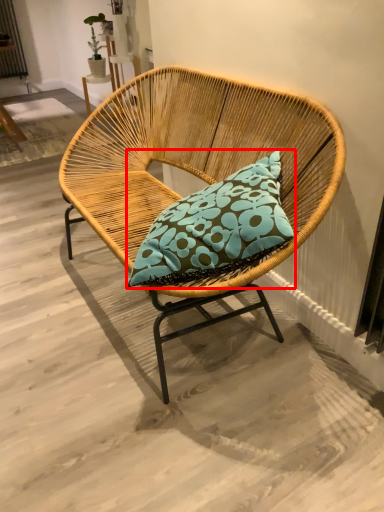
Question: From the image, what is the correct spatial relationship of pillow (annotated by the red box) in relation to chair?

Choices:
 (A) right
 (B) left

Answer: (A)